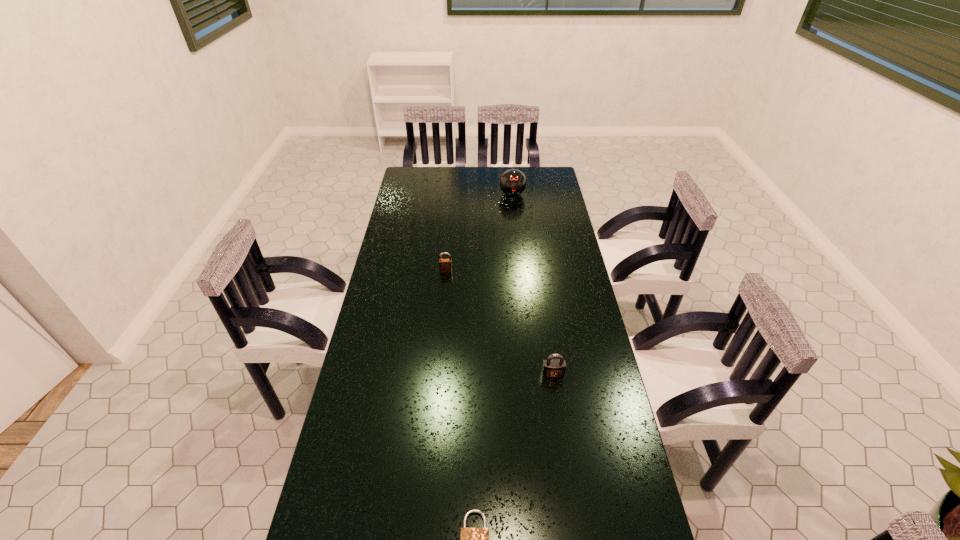
At what (x,y) coordinates should I click in order to perform the action: click on bowling ball. Please return your answer as a coordinate pair (x, y). The width and height of the screenshot is (960, 540). Looking at the image, I should click on (512, 182).

Identify the location of the tallest object. The width and height of the screenshot is (960, 540). (512, 182).

You are a GUI agent. You are given a task and a screenshot of the screen. Output one action in this format:
    pyautogui.click(x=<x>, y=<y>)
    Task: Click on the third farthest object
    This screenshot has width=960, height=540.
    Given the screenshot: What is the action you would take?
    pyautogui.click(x=553, y=368)

At what (x,y) coordinates should I click in order to perform the action: click on the rightmost padlock. Please return your answer as a coordinate pair (x, y). Looking at the image, I should click on (553, 368).

Locate an element on the screen. This screenshot has height=540, width=960. the second farthest object is located at coordinates point(445,265).

Locate an element on the screen. The image size is (960, 540). the leftmost padlock is located at coordinates (445, 265).

Locate an element on the screen. This screenshot has height=540, width=960. vacant area located on the surface of the farthest object near the finger holes is located at coordinates (516, 225).

The width and height of the screenshot is (960, 540). I want to click on free spot located 0.320m on the front of the second farthest padlock near the keyhole, so click(568, 481).

Find the location of a particular element. The image size is (960, 540). vacant position located 0.190m on the front-facing side of the second farthest object is located at coordinates (443, 307).

Find the location of a particular element. The image size is (960, 540). object that is at the far edge is located at coordinates (512, 182).